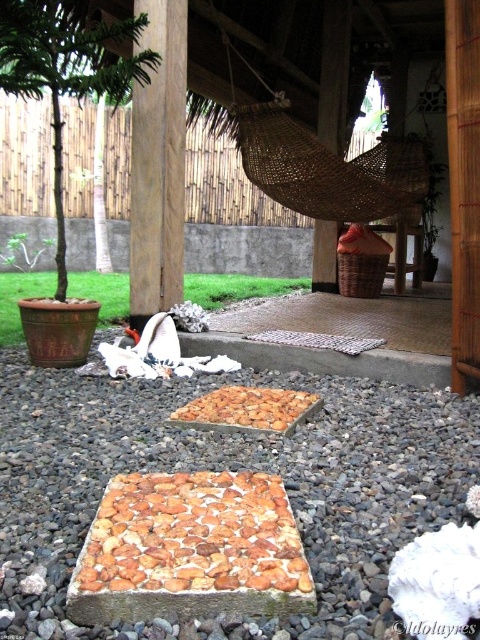
You are a gardener planning to plant a small shrub in the center of the pathway between the two stepping stones. The shrub requires soil that is loose and well drained. Which material at the center should you use for planting the shrub, the brown gravel at center or the golden brown crumbly at center?

The golden brown crumbly at center is positioned above the brown gravel at center. Since the shrub needs loose and well drained soil, the golden brown crumbly at center is more suitable as it is likely to be crumbly and loose, whereas the gravel may be too dense for proper drainage.

You are a bird flying over the spa area. You see the brown crumbly bread at center and the brown wood post at center. Which one is smaller in size?

The brown crumbly bread at center is smaller than the brown wood post at center.